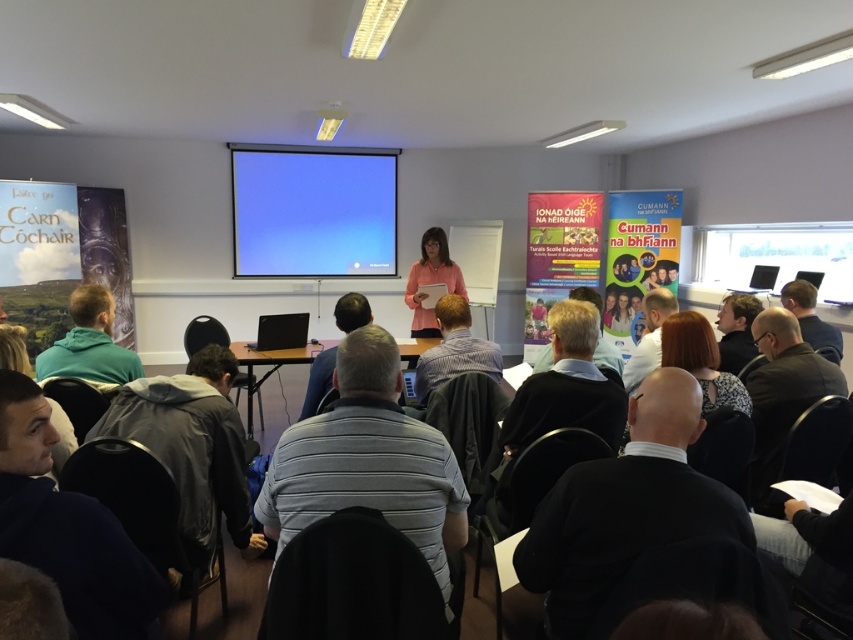
You are sitting in the front row of the conference room and want to take a photo of both point (468, 348) and point (729, 326). Which point will appear larger in your photo?

Point (468, 348) will appear larger in the photo because it is closer to the camera than point (729, 326).

You are a photographer trying to capture a clear shot of both the dark brown hair at center and the matte black jacket at upper right. Which object should you focus on first to ensure both are in frame?

The dark brown hair at center is positioned on the left side of matte black jacket at upper right, so you should focus on the dark brown hair at center first to ensure both are in frame.